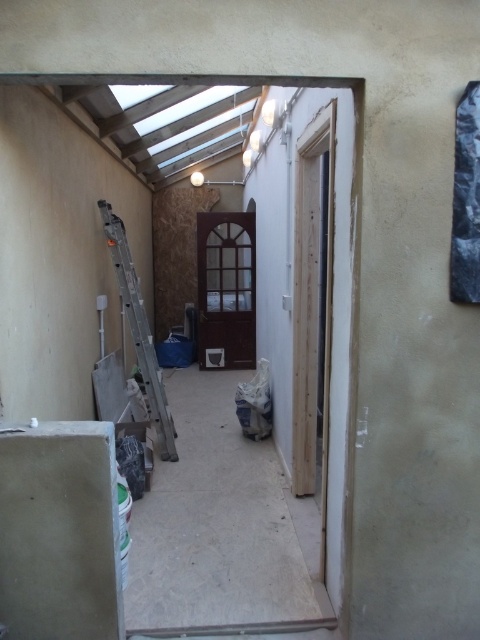
Consider the image. You are a contractor measuring door widths for a new set of doors. You need to know which object has a greater width between the brown wooden door at center and the silver metallic ladder at left. Which one is wider?

The brown wooden door at center has a greater width than the silver metallic ladder at left according to the description.

You are a delivery person carrying a package that is 3 meters long. You need to move it through the space between the brown wooden door at center and the silver metallic ladder at left. Can you fit the package through that space?

The distance between the brown wooden door at center and the silver metallic ladder at left is 2.93 meters. Since the package is 3 meters long, it is slightly longer than the available space, so the package cannot fit through that space.

You are a contractor assessing the space. You need to determine if the silver metallic ladder at left can fit through the doorway of the brown wooden door at center without being disassembled. Based on their sizes, what is your assessment?

The brown wooden door at center is larger in size than the silver metallic ladder at left, so the ladder can fit through the doorway as it is smaller than the door.